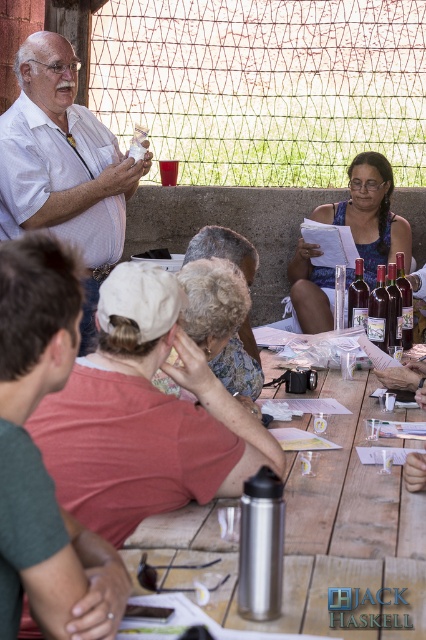
Which of these two, white matte water bottle at center or dark red glass bottle at center, stands taller?

white matte water bottle at center

Who is lower down, white matte water bottle at center or dark red glass bottle at center?

white matte water bottle at center is below.

The height and width of the screenshot is (640, 426). Identify the location of white matte water bottle at center. (143, 417).

Where is `white matte water bottle at center`? The image size is (426, 640). white matte water bottle at center is located at coordinates (143, 417).

Does wooden table at center appear on the left side of gray fabric cap at center?

No, wooden table at center is not to the left of gray fabric cap at center.

Based on the photo, which is more to the left, wooden table at center or gray fabric cap at center?

Positioned to the left is gray fabric cap at center.

Does point (353, 563) come closer to viewer compared to point (224, 346)?

Yes, point (353, 563) is closer to viewer.

Find the location of a particular element. This screenshot has height=640, width=426. wooden table at center is located at coordinates (322, 531).

Is white shirt at upper left further to the viewer compared to dark red glass bottle at center?

Yes, white shirt at upper left is further from the viewer.

Does white shirt at upper left have a smaller size compared to dark red glass bottle at center?

No, white shirt at upper left is not smaller than dark red glass bottle at center.

Is point (86, 243) positioned after point (376, 285)?

Yes, it is.

You are a GUI agent. You are given a task and a screenshot of the screen. Output one action in this format:
    pyautogui.click(x=<x>, y=<y>)
    Task: Click on the white shirt at upper left
    
    Given the screenshot: What is the action you would take?
    pyautogui.click(x=63, y=164)